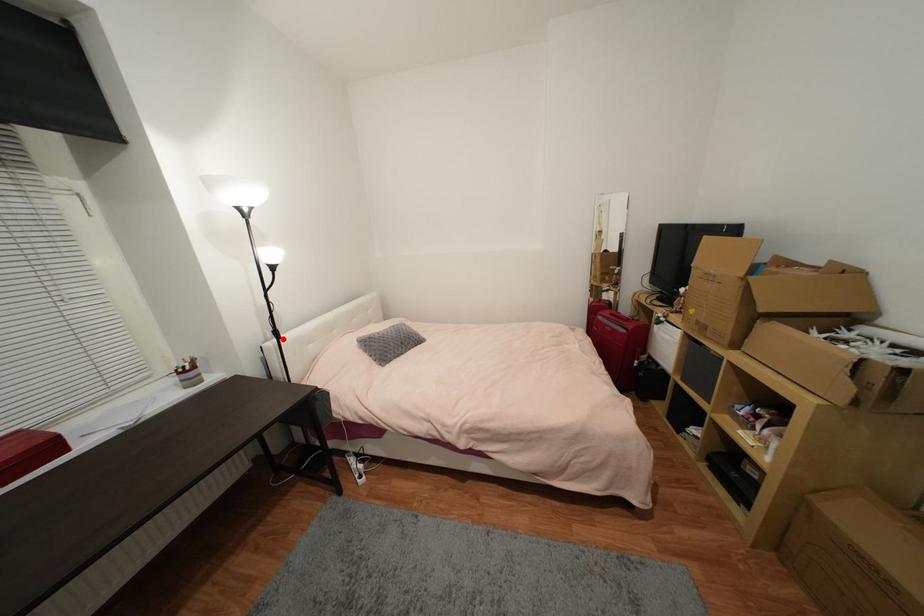
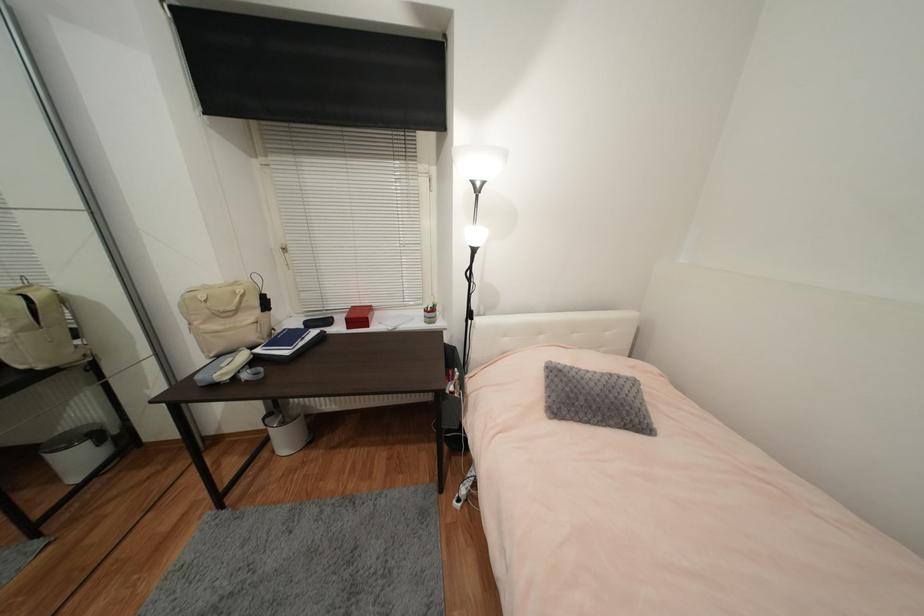
Question: I am providing you with two images of the same scene from different viewpoints. A red point is marked on the first image. At the location where the point appears in image 1, is it still visible in image 2?

Choices:
 (A) Yes
 (B) No

Answer: (A)